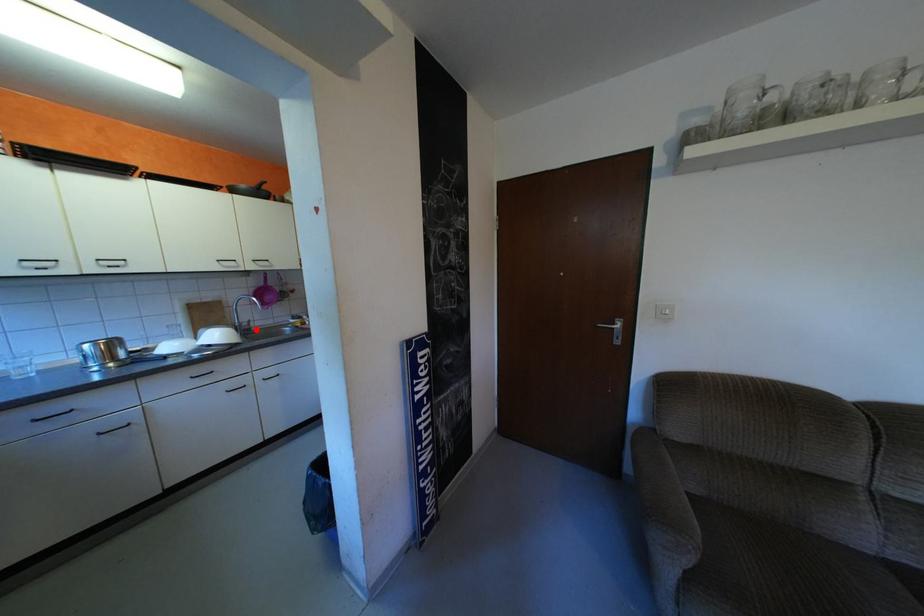
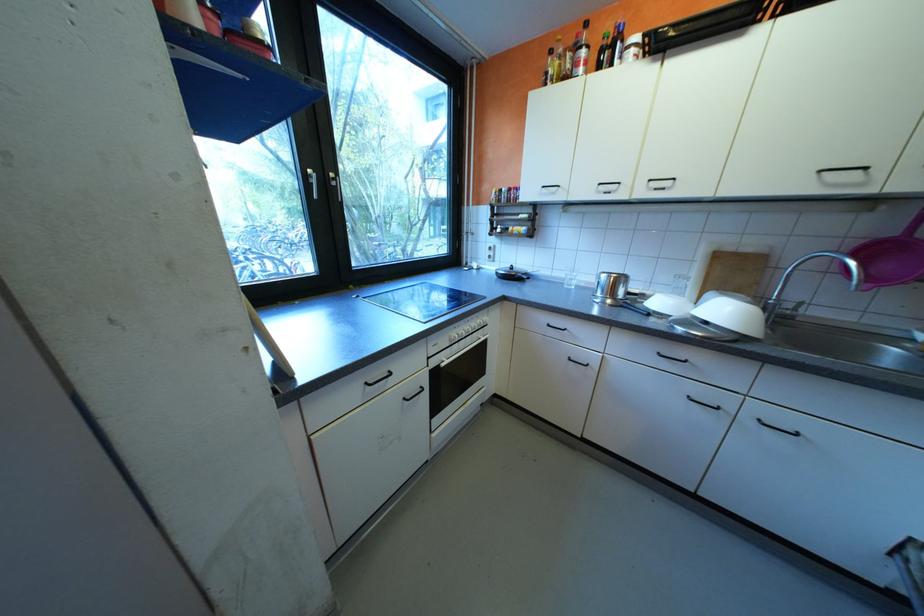
Locate, in the second image, the point that corresponds to the highlighted location in the first image.

(791, 317)